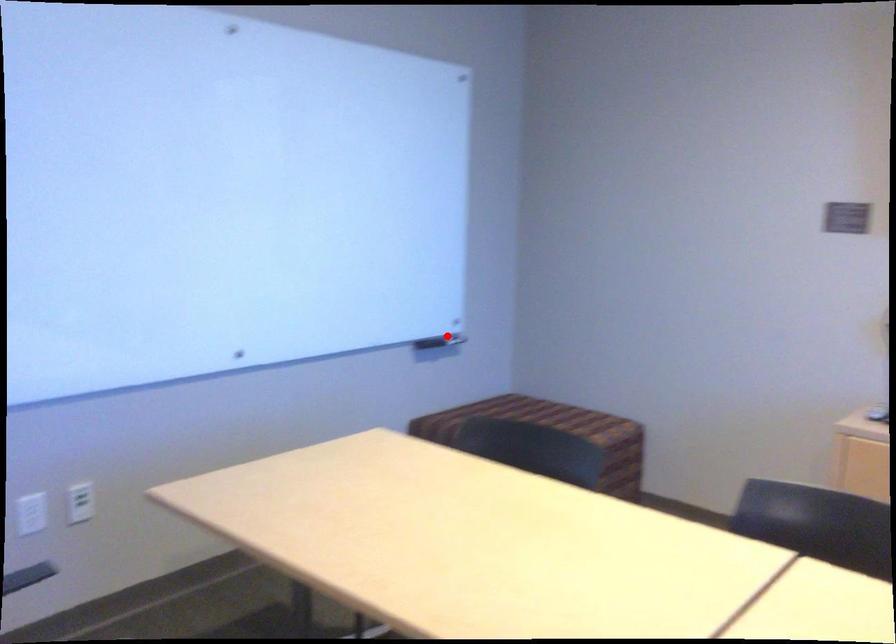
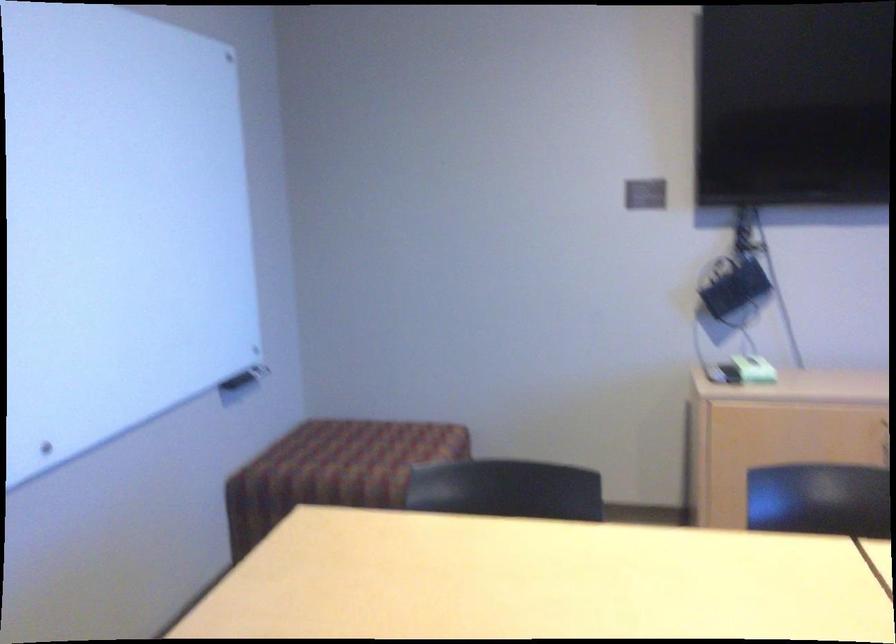
Find the pixel in the second image that matches the highlighted location in the first image.

(246, 373)